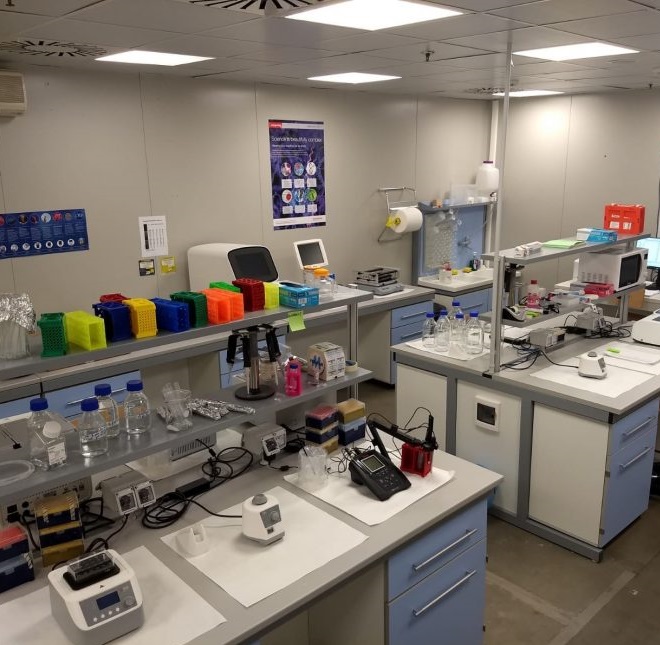
What are the coordinates of `glass bottles` in the screenshot? It's located at (143, 431), (112, 417), (99, 435), (45, 433).